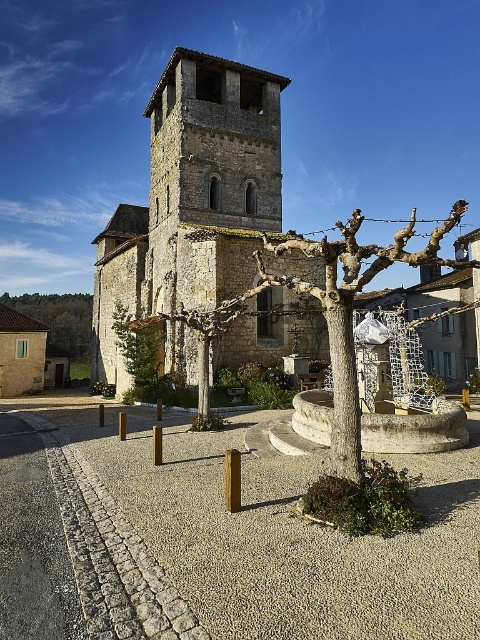
You are standing in the courtyard looking towards the historic stone church. You notice the stone tower at center and the green leafy tree at center. Which object appears closer to you based on their positions?

The stone tower at center is positioned over the green leafy tree at center, meaning the tower is closer to you than the tree.

You are standing at the entrance of the historic stone church and want to find the green leafy tree at lower left. According to the coordinates given, where should you look relative to your current position?

The green leafy tree at lower left is located at coordinates point (60, 317), which means it is positioned slightly to the left and near the bottom of your field of view relative to your current position at the entrance.

You are standing at the entrance of the historic stone church and want to walk towards the bell tower. There are two points marked on the ground in the courtyard. One is point (351, 284) and the other is point (156, 360). Which point should you step on first if you want to reach the bell tower as quickly as possible?

Point (351, 284) is in front of point (156, 360), so stepping on point (351, 284) first would be closer to the bell tower and thus quicker.